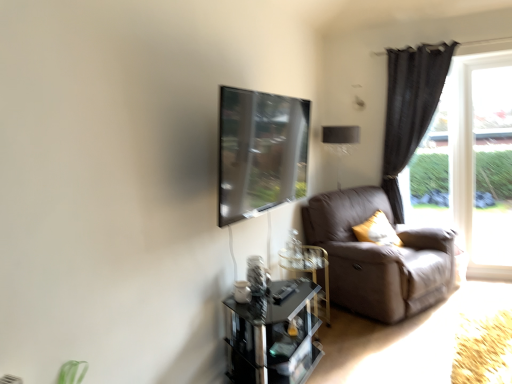
Question: Is point (421, 292) closer or farther from the camera than point (409, 64)?

Choices:
 (A) closer
 (B) farther

Answer: (A)

Question: Based on their positions, is leather at right located to the left or right of dark gray fabric curtain at right?

Choices:
 (A) left
 (B) right

Answer: (A)

Question: Considering the real-world distances, which object is farthest from the yellow fabric pillow at right?

Choices:
 (A) dark gray fabric curtain at right
 (B) transparent glass table at lower center
 (C) transparent glass window at right
 (D) clear glass table at lower center
 (E) clear glass door at right

Answer: (B)

Question: Which of these objects is positioned closest to the dark gray fabric curtain at right?

Choices:
 (A) transparent glass window at right
 (B) transparent glass window screen at upper center
 (C) leather at right
 (D) clear glass door at right
 (E) transparent glass table at lower center

Answer: (A)